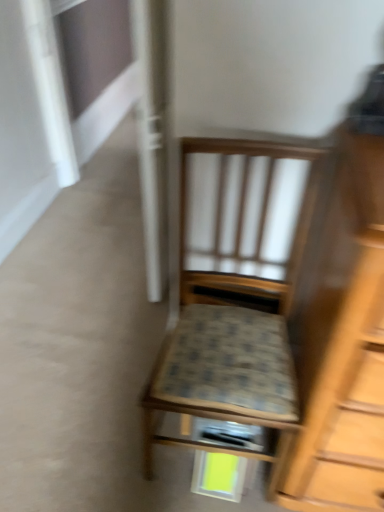
Identify the location of wooden chair at center. Image resolution: width=384 pixels, height=512 pixels. (235, 295).

Describe the element at coordinates (235, 295) in the screenshot. I see `wooden chair at center` at that location.

Identify the location of wooden chair at center. [235, 295].